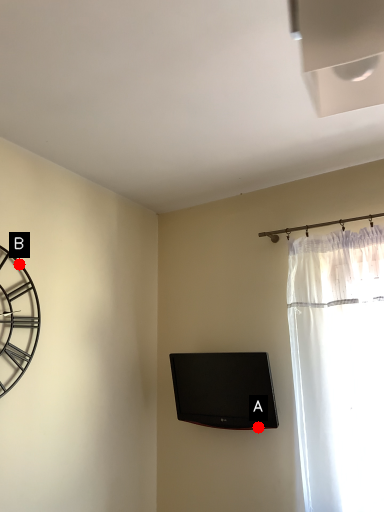
Question: Two points are circled on the image, labeled by A and B beside each circle. Which point appears closest to the camera in this image?

Choices:
 (A) A is closer
 (B) B is closer

Answer: (B)